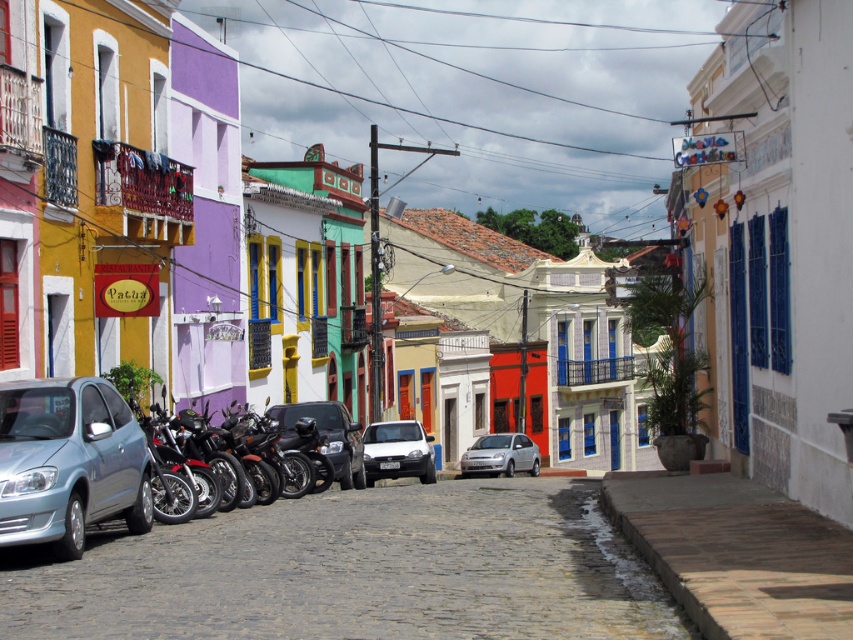
You are driving a light blue metallic car at lower left and want to park it in the gray cobblestone alley at center. Can the car fit into the alley based on their widths?

The gray cobblestone alley at center is wider than the light blue metallic car at lower left, so the car can fit into the alley.

You are standing at point (242, 544) and want to walk to the nearest building entrance. The buildings are all 10 meters tall. If you walk straight ahead, will you reach the entrance before the building? Explain your reasoning.

Since the point (242, 544) is 11.30 meters away from the nearest building entrance, and the buildings are 10 meters tall, walking straight ahead would mean you would reach the entrance before the building because the distance to the entrance is greater than the building height. However, this might not make sense spatially as buildings are vertical structures. Perhaps there is confusion in the question parameters.

You are standing on the gray cobblestone alley at center and want to reach the silver metallic car at center. Which direction should you move to get closer to the car?

You should move forward because the gray cobblestone alley at center is closer to the viewer than the silver metallic car at center, so moving toward the car would require going forward along the alley.